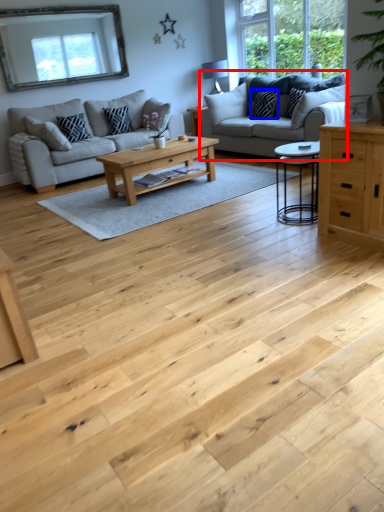
Question: Which object appears closest to the camera in this image, studio couch (highlighted by a red box) or pillow (highlighted by a blue box)?

Choices:
 (A) studio couch
 (B) pillow

Answer: (A)